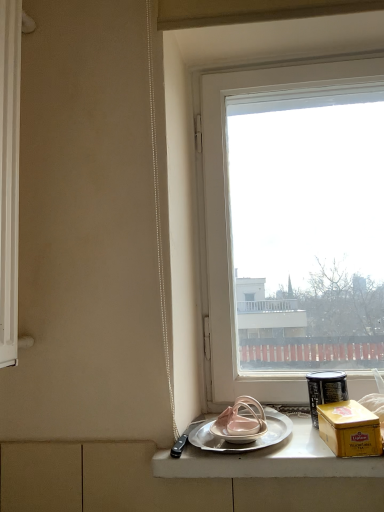
Image resolution: width=384 pixels, height=512 pixels. In order to click on vacant space positioned to the left of yellow matte box at right in this screenshot , I will do `click(309, 449)`.